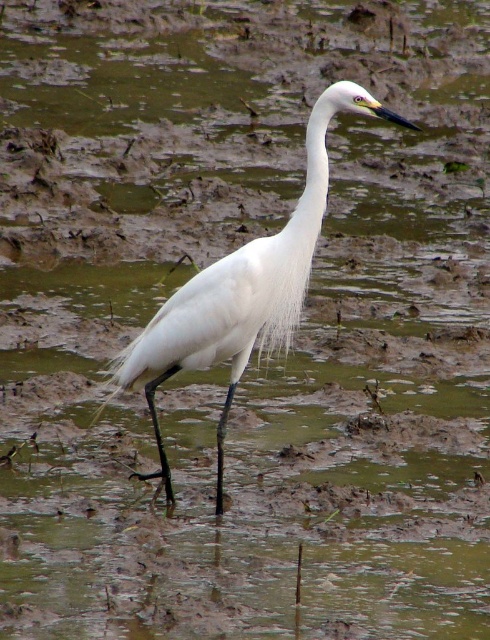
You are observing a white feathered bird at center and a white feathered neck at center in the image. Which object has a greater width?

The white feathered bird at center might be wider than white feathered neck at center according to the description.

You are a photographer trying to capture the white feathered bird at center in the image. Based on its position, where should you aim your camera to ensure the bird is centered in your shot?

The white feathered bird at center is located at coordinates approximately 0.455 on the x axis and 0.494 on the y axis, so you should aim your camera at that point to center the bird in your shot.